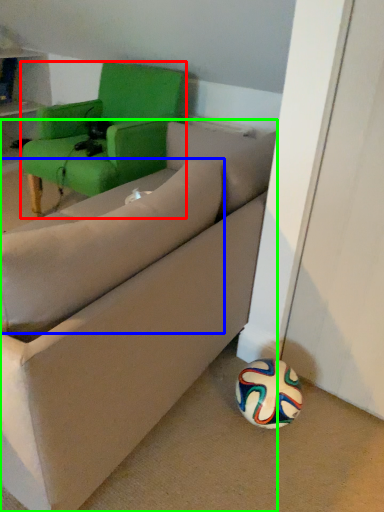
Question: Estimate the real-world distances between objects in this image. Which object is closer to chair (highlighted by a red box), pillow (highlighted by a blue box) or studio couch (highlighted by a green box)?

Choices:
 (A) pillow
 (B) studio couch

Answer: (B)